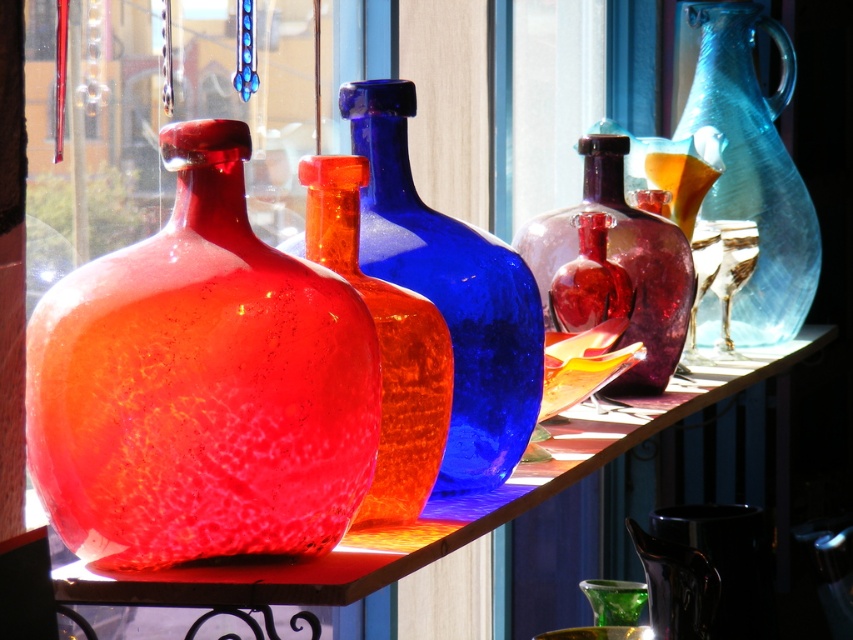
Question: Which of the following is the closest to the observer?

Choices:
 (A) translucent orange glass vase at center
 (B) crackle glass vase at center

Answer: (B)

Question: Which point is closer to the camera?

Choices:
 (A) (572, 237)
 (B) (68, 349)

Answer: (B)

Question: Which point is farther from the camera taking this photo?

Choices:
 (A) (457, 442)
 (B) (306, 172)

Answer: (A)

Question: Does matte glass vase at left have a greater width compared to translucent orange glass vase at center?

Choices:
 (A) yes
 (B) no

Answer: (A)

Question: Does crackle glass vase at center have a lesser width compared to transparent blue glass pitcher at right?

Choices:
 (A) yes
 (B) no

Answer: (B)

Question: Is crackle glass vase at center wider than transparent blue glass pitcher at right?

Choices:
 (A) no
 (B) yes

Answer: (B)